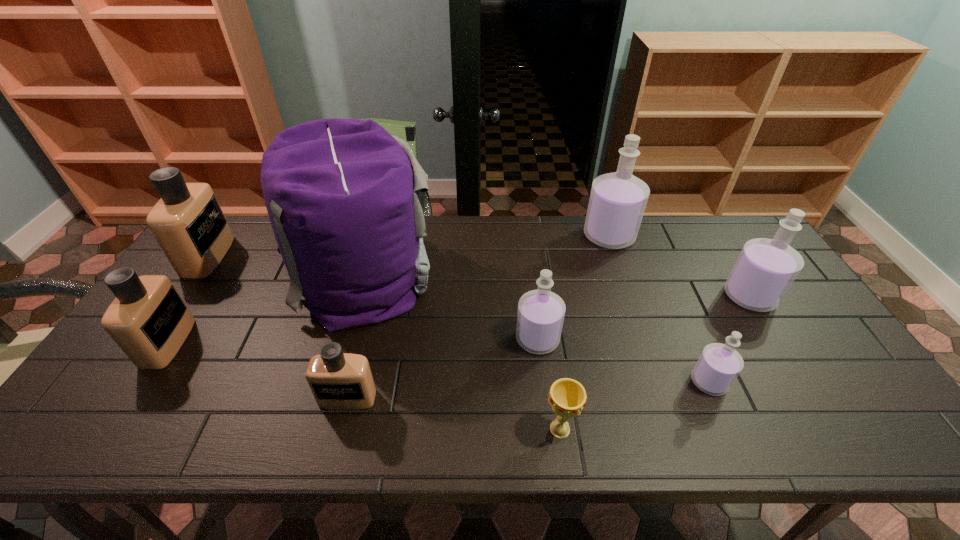
In order to click on blank area in the image that satisfies the following two spatial constraints: 1. on the front pocket of the third biggest purple perfume; 2. on the right side of the tallest object in this screenshot , I will do `click(342, 339)`.

In order to click on blank space that satisfies the following two spatial constraints: 1. on the front label of the farthest beige perfume; 2. on the left side of the chalice in this screenshot , I will do `click(87, 429)`.

Where is `free space that satisfies the following two spatial constraints: 1. on the front side of the tallest perfume; 2. on the front label of the farthest beige perfume`? This screenshot has width=960, height=540. free space that satisfies the following two spatial constraints: 1. on the front side of the tallest perfume; 2. on the front label of the farthest beige perfume is located at coordinates (616, 256).

At what (x,y) coordinates should I click in order to perform the action: click on free space that satisfies the following two spatial constraints: 1. on the front pocket of the second farthest purple perfume; 2. on the left side of the purple backpack. Please return your answer as a coordinate pair (x, y). This screenshot has height=540, width=960. Looking at the image, I should click on (354, 297).

Locate an element on the screen. The image size is (960, 540). free location that satisfies the following two spatial constraints: 1. on the front label of the second nearest beige perfume; 2. on the back side of the nearest purple perfume is located at coordinates (142, 382).